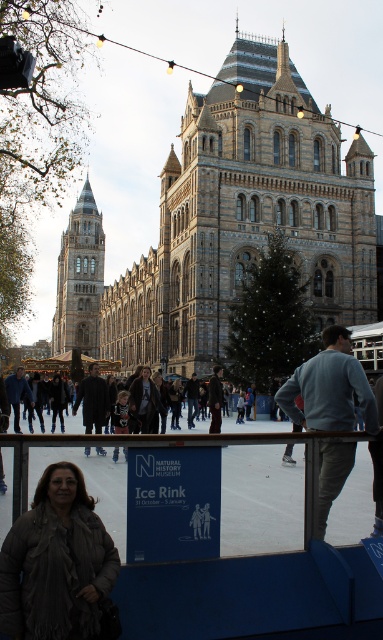
Can you confirm if light blue sweater at center is positioned to the right of dark brown leather coat at center?

Yes, light blue sweater at center is to the right of dark brown leather coat at center.

Does point (325, 422) come closer to viewer compared to point (93, 419)?

Yes, point (325, 422) is closer to viewer.

Identify the location of light blue sweater at center. (330, 387).

Based on the photo, who is higher up, brown stone tower at center or dark gray sweater at center?

brown stone tower at center is above.

This screenshot has height=640, width=383. In order to click on brown stone tower at center in this screenshot , I will do `click(258, 204)`.

Looking at this image, is brown stone tower at center positioned before light blue sweater at center?

No, brown stone tower at center is further to the viewer.

This screenshot has height=640, width=383. What do you see at coordinates (258, 204) in the screenshot?
I see `brown stone tower at center` at bounding box center [258, 204].

I want to click on brown stone tower at center, so click(x=258, y=204).